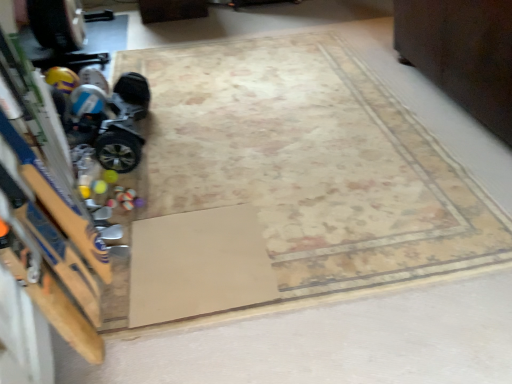
The height and width of the screenshot is (384, 512). Identify the location of vacant area located to the right-hand side of shiny metallic hoverboard at left. (200, 132).